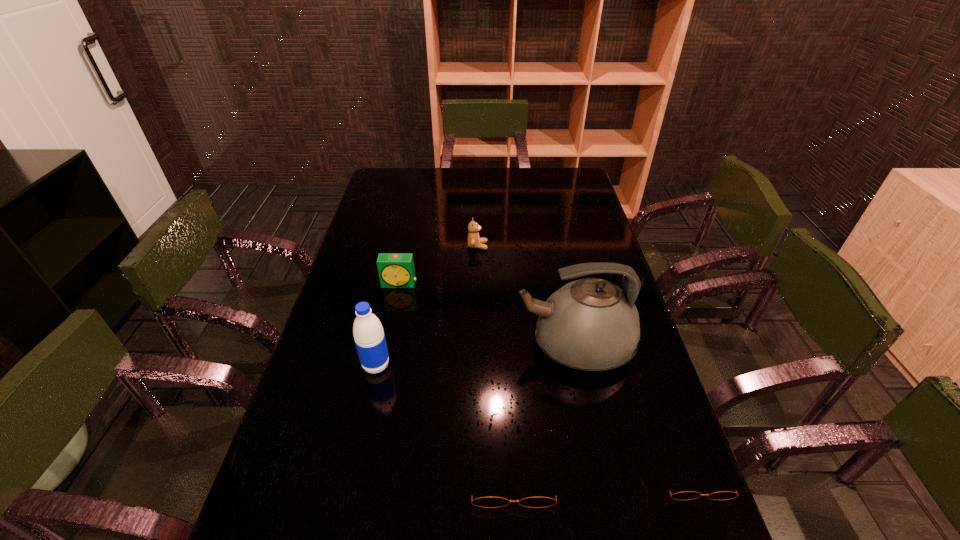
Locate an element on the screen. the left sunglasses is located at coordinates (487, 502).

Locate an element on the screen. The height and width of the screenshot is (540, 960). the fifth tallest object is located at coordinates (487, 502).

The width and height of the screenshot is (960, 540). I want to click on the shorter sunglasses, so click(x=687, y=495).

Where is `the right sunglasses`? the right sunglasses is located at coordinates (687, 495).

Identify the location of alarm clock. (396, 270).

The height and width of the screenshot is (540, 960). I want to click on the tallest object, so click(x=590, y=324).

Image resolution: width=960 pixels, height=540 pixels. I want to click on water bottle, so click(369, 337).

Find the location of a particular element. The image size is (960, 540). teddy bear is located at coordinates (474, 241).

The height and width of the screenshot is (540, 960). I want to click on vacant space located 0.190m on the front-facing side of the second farthest object, so click(390, 333).

Locate an element on the screen. This screenshot has width=960, height=540. blank area located at the spout of the tallest object is located at coordinates (384, 345).